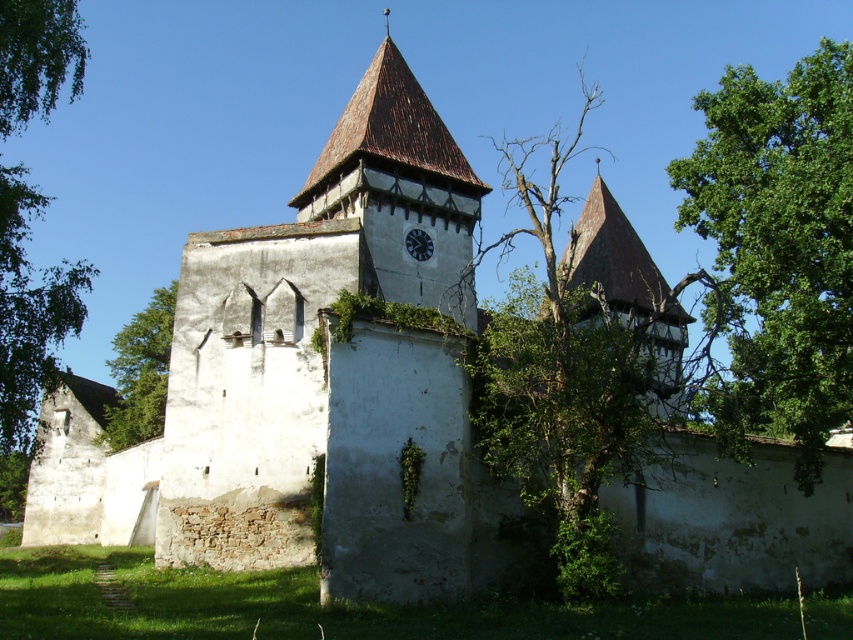
Question: Which of the following is the closest to the observer?

Choices:
 (A) (137, 312)
 (B) (20, 72)
 (C) (412, 230)

Answer: (B)

Question: In this image, where is green leafy tree at upper right located relative to matte black clock at center?

Choices:
 (A) right
 (B) left

Answer: (A)

Question: Does green leafy tree at left come in front of matte black clock at center?

Choices:
 (A) yes
 (B) no

Answer: (A)

Question: Is green leafy tree at left thinner than green leafy tree at center?

Choices:
 (A) no
 (B) yes

Answer: (A)

Question: Among these points, which one is farthest from the camera?

Choices:
 (A) (39, 305)
 (B) (798, 124)
 (C) (410, 234)

Answer: (C)

Question: Estimate the real-world distances between objects in this image. Which object is farther from the green leafy tree at upper right?

Choices:
 (A) matte black clock at center
 (B) green leafy tree at left

Answer: (B)